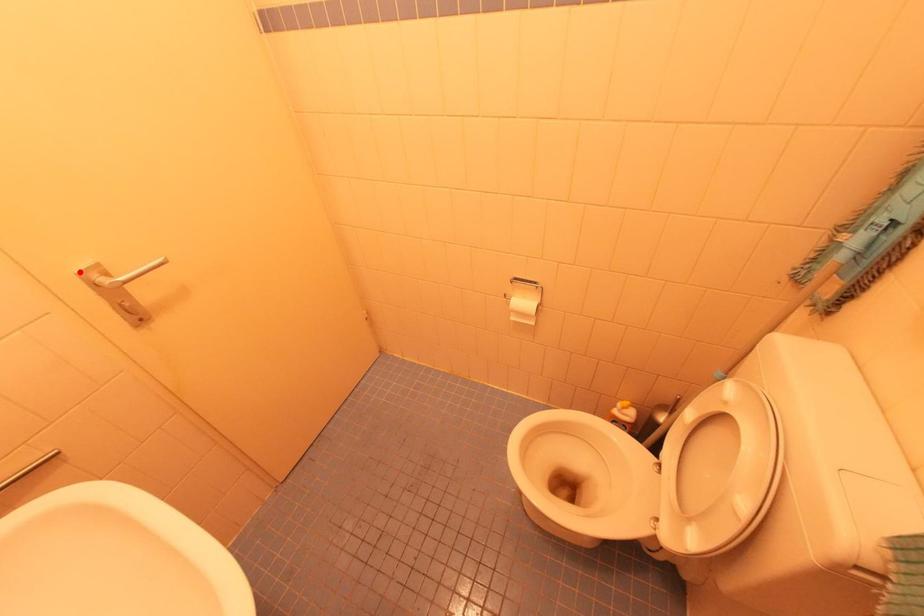
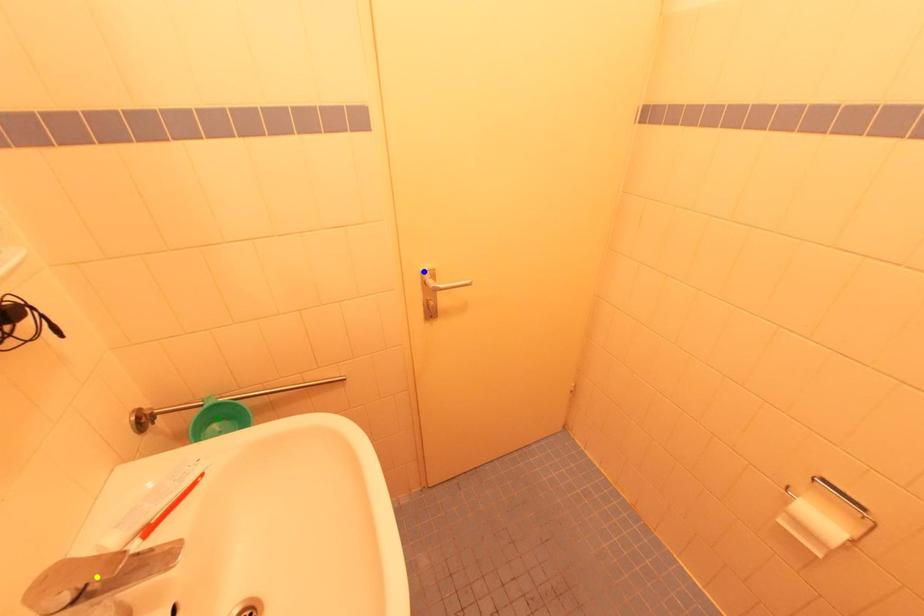
Question: I am providing you with two images of the same scene from different viewpoints. A red point is marked on the first image. You are given multiple points on the second image. Which mark in image 2 goes with the point in image 1?

Choices:
 (A) green point
 (B) blue point
 (C) yellow point

Answer: (B)